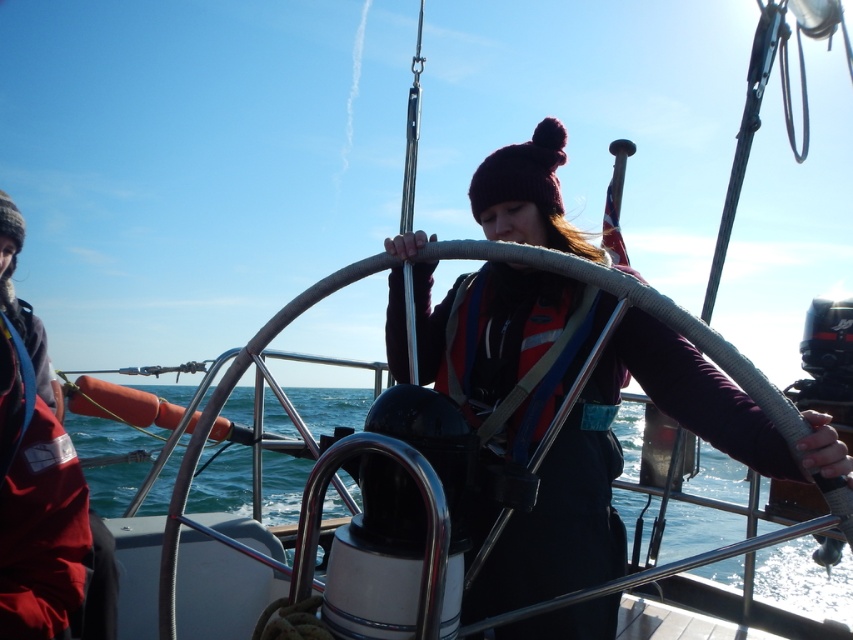
Can you confirm if matte black life vest at center is bigger than red life jacket at center?

Yes, matte black life vest at center is bigger than red life jacket at center.

Between matte black life vest at center and red life jacket at center, which one is positioned higher?

red life jacket at center

Is point (751, 410) positioned in front of point (509, 403)?

That is True.

At what (x,y) coordinates should I click in order to perform the action: click on matte black life vest at center. Please return your answer as a coordinate pair (x, y). The height and width of the screenshot is (640, 853). Looking at the image, I should click on (556, 528).

Does matte black life vest at center have a greater height compared to blue water at center?

No.

Which is below, matte black life vest at center or blue water at center?

blue water at center is below.

Is point (492, 342) positioned behind point (701, 486)?

No, it is not.

At what (x,y) coordinates should I click in order to perform the action: click on matte black life vest at center. Please return your answer as a coordinate pair (x, y). This screenshot has height=640, width=853. Looking at the image, I should click on (556, 528).

Does blue water at center have a greater width compared to red life jacket at center?

Correct, the width of blue water at center exceeds that of red life jacket at center.

Is blue water at center positioned before red life jacket at center?

No, blue water at center is further to the viewer.

Between point (364, 390) and point (468, 324), which one is positioned behind?

The point (364, 390) is behind.

You are a GUI agent. You are given a task and a screenshot of the screen. Output one action in this format:
    pyautogui.click(x=<x>, y=<y>)
    Task: Click on the blue water at center
    The height and width of the screenshot is (640, 853).
    Given the screenshot: What is the action you would take?
    pyautogui.click(x=705, y=508)